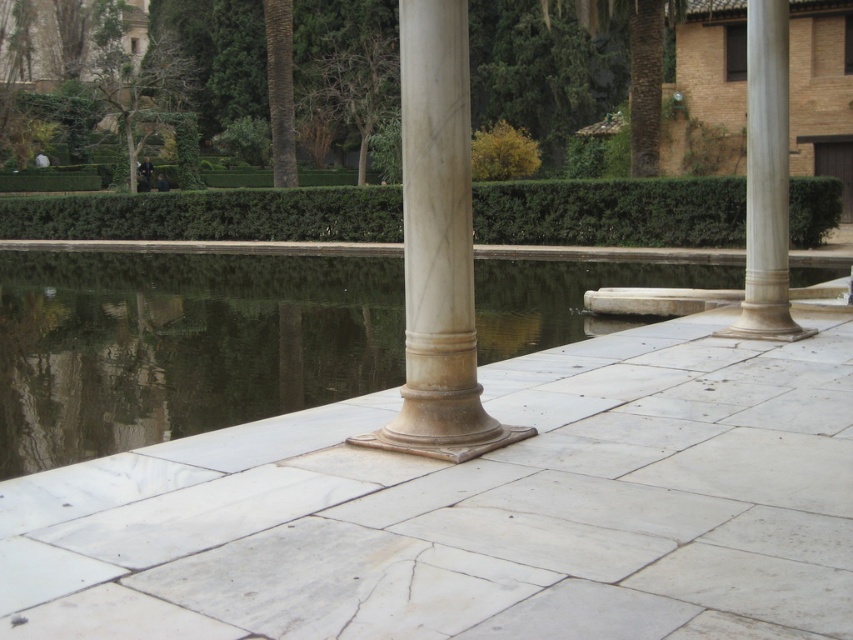
Question: Which object appears farthest from the camera in this image?

Choices:
 (A) white marble column at right
 (B) white marble column at center
 (C) green leafy hedge at center
 (D) smooth stone water at center

Answer: (A)

Question: Is white marble column at center smaller than white marble column at right?

Choices:
 (A) no
 (B) yes

Answer: (B)

Question: Which of the following is the farthest from the observer?

Choices:
 (A) white marble column at center
 (B) white marble column at right

Answer: (B)

Question: Among these points, which one is farthest from the camera?

Choices:
 (A) (782, 156)
 (B) (4, 339)
 (C) (431, 36)

Answer: (B)

Question: Does smooth stone water at center appear over white marble column at center?

Choices:
 (A) no
 (B) yes

Answer: (A)

Question: Is white marble column at center positioned before white marble column at right?

Choices:
 (A) yes
 (B) no

Answer: (A)